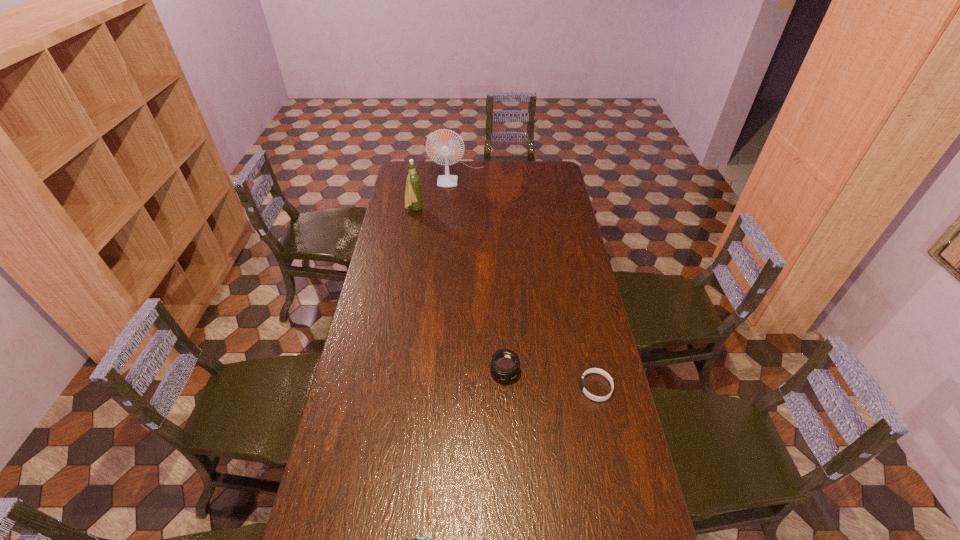
Image resolution: width=960 pixels, height=540 pixels. Find the location of `vacant position located 0.280m on the outer surface of the fourth tallest object`. vacant position located 0.280m on the outer surface of the fourth tallest object is located at coordinates 498,388.

Where is `vacant space located on the outer surface of the fourth tallest object`? vacant space located on the outer surface of the fourth tallest object is located at coordinates pyautogui.click(x=545, y=388).

At what (x,y) coordinates should I click in order to perform the action: click on blank space located on the outer surface of the fourth tallest object. Please return your answer as a coordinate pair (x, y). Looking at the image, I should click on (513, 388).

This screenshot has width=960, height=540. I want to click on object located in the far edge section of the desktop, so click(445, 147).

This screenshot has height=540, width=960. I want to click on object located in the left edge section of the desktop, so click(413, 194).

This screenshot has width=960, height=540. Find the location of `object at the right edge`. object at the right edge is located at coordinates (593, 370).

Identify the location of vacant space at the far edge of the desktop. (481, 166).

In the image, there is a desktop. At what (x,y) coordinates should I click in order to perform the action: click on free space at the left edge. Please return your answer as a coordinate pair (x, y). This screenshot has width=960, height=540. Looking at the image, I should click on (382, 260).

Where is `vacant space at the right edge of the desktop`? The height and width of the screenshot is (540, 960). vacant space at the right edge of the desktop is located at coordinates (588, 285).

In the image, there is a desktop. Where is `vacant space at the far right corner`? The image size is (960, 540). vacant space at the far right corner is located at coordinates (541, 172).